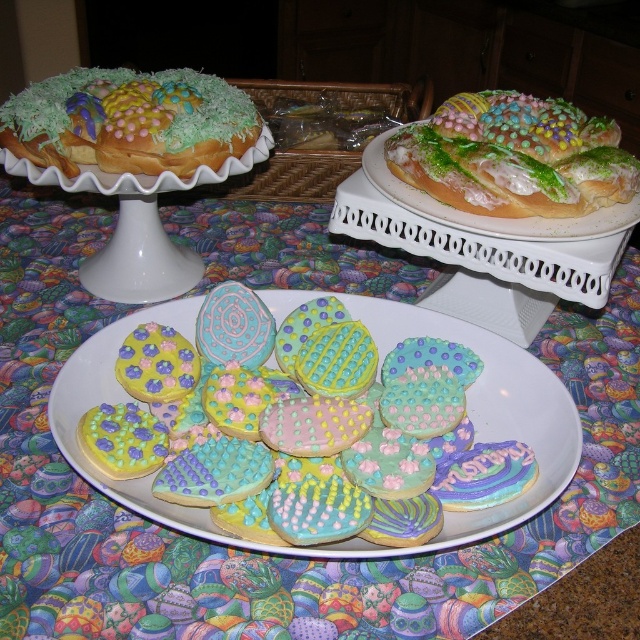
Is the position of pastel frosted pastry at center less distant than that of pastel frosted cake at upper left?

Yes, pastel frosted pastry at center is closer to the viewer.

Does pastel frosted pastry at center have a smaller size compared to pastel frosted cake at upper left?

Yes, pastel frosted pastry at center is smaller than pastel frosted cake at upper left.

At what (x,y) coordinates should I click in order to perform the action: click on pastel frosted pastry at center. Please return your answer as a coordinate pair (x, y). The image size is (640, 640). Looking at the image, I should click on (515, 156).

Who is more forward, (451, 333) or (573, 108)?

Point (451, 333) is in front.

Is point (458, 513) in front of point (563, 173)?

Yes.

This screenshot has height=640, width=640. I want to click on matte sugar cookies at center, so click(378, 365).

Does egg-patterned fabric at center have a greater width compared to pastel frosted cake at upper left?

Yes, egg-patterned fabric at center is wider than pastel frosted cake at upper left.

Describe the element at coordinates (253, 550) in the screenshot. This screenshot has width=640, height=640. I see `egg-patterned fabric at center` at that location.

At what (x,y) coordinates should I click in order to perform the action: click on egg-patterned fabric at center. Please return your answer as a coordinate pair (x, y). Looking at the image, I should click on (253, 550).